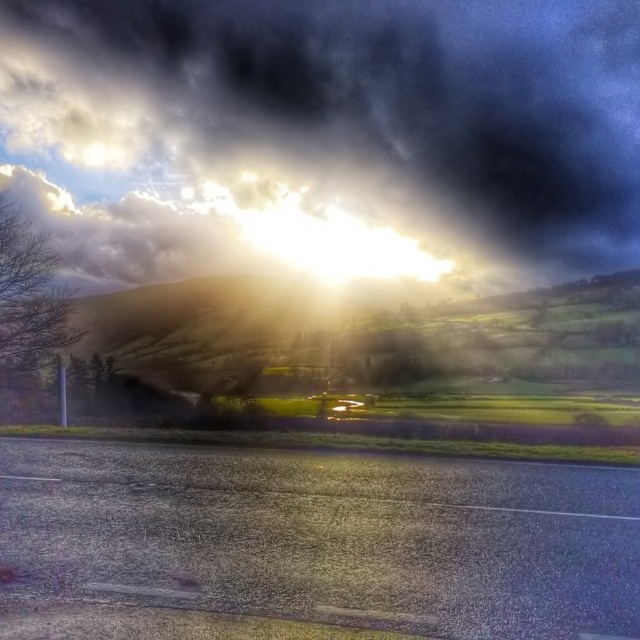
Question: Does dark gray cloud at upper center appear on the left side of bare branches at left?

Choices:
 (A) yes
 (B) no

Answer: (B)

Question: Is dark gray cloud at upper center closer to camera compared to bare branches at left?

Choices:
 (A) yes
 (B) no

Answer: (B)

Question: Is dark gray cloud at upper center wider than bare branches at left?

Choices:
 (A) yes
 (B) no

Answer: (A)

Question: Which object appears closest to the camera in this image?

Choices:
 (A) bare branches at left
 (B) dark gray cloud at upper center

Answer: (A)